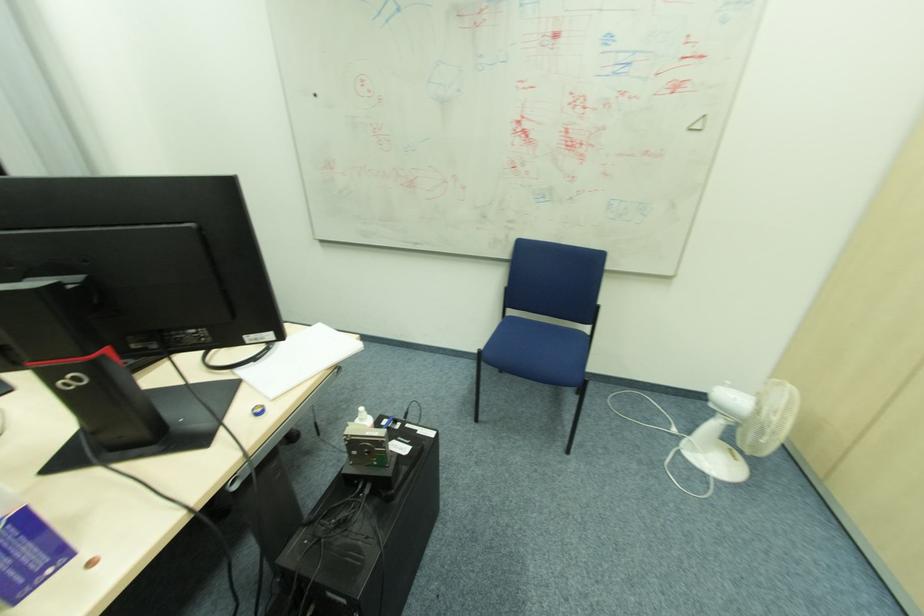
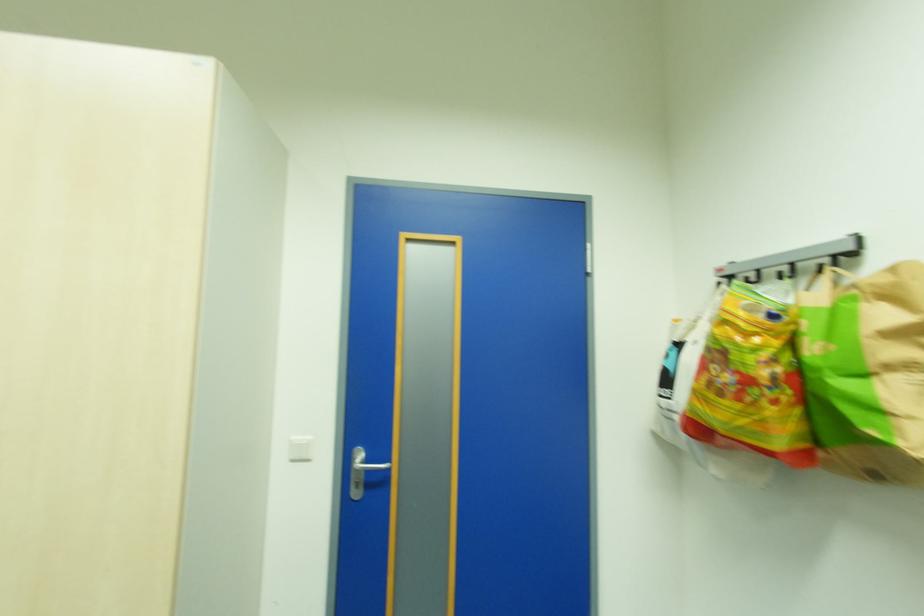
Question: The camera is either moving clockwise (left) or counter-clockwise (right) around the object. The first image is from the beginning of the video and the second image is from the end. Is the camera moving left or right when shooting the video?

Choices:
 (A) Left
 (B) Right

Answer: (A)